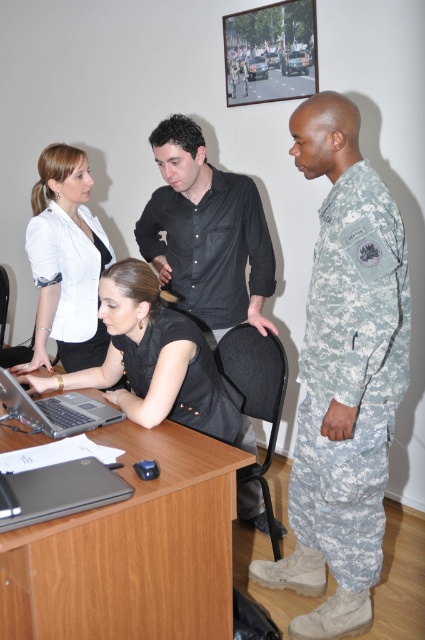
Who is more distant from viewer, (184,497) or (198,208)?

Positioned behind is point (198,208).

Describe the element at coordinates (133, 548) in the screenshot. I see `brown wood table at center` at that location.

Describe the element at coordinates (133, 548) in the screenshot. This screenshot has width=425, height=640. I see `brown wood table at center` at that location.

Where is `brown wood table at center`? brown wood table at center is located at coordinates (133, 548).

Who is positioned more to the right, black matte dress at center or silver metallic laptop at center?

From the viewer's perspective, black matte dress at center appears more on the right side.

Looking at this image, does black matte dress at center appear on the left side of silver metallic laptop at center?

Incorrect, black matte dress at center is not on the left side of silver metallic laptop at center.

Looking at this image, who is more forward, (186, 371) or (0, 396)?

Point (0, 396) is in front.

This screenshot has width=425, height=640. I want to click on black matte dress at center, so click(x=153, y=358).

Who is taller, camouflage fabric uniform at right or black matte laptop at lower left?

camouflage fabric uniform at right is taller.

Is camouflage fabric uniform at right further to the viewer compared to black matte laptop at lower left?

Yes, camouflage fabric uniform at right is behind black matte laptop at lower left.

Who is more forward, (373, 262) or (45, 499)?

Point (45, 499)

In order to click on camouflage fabric uniform at right in this screenshot , I will do `click(351, 376)`.